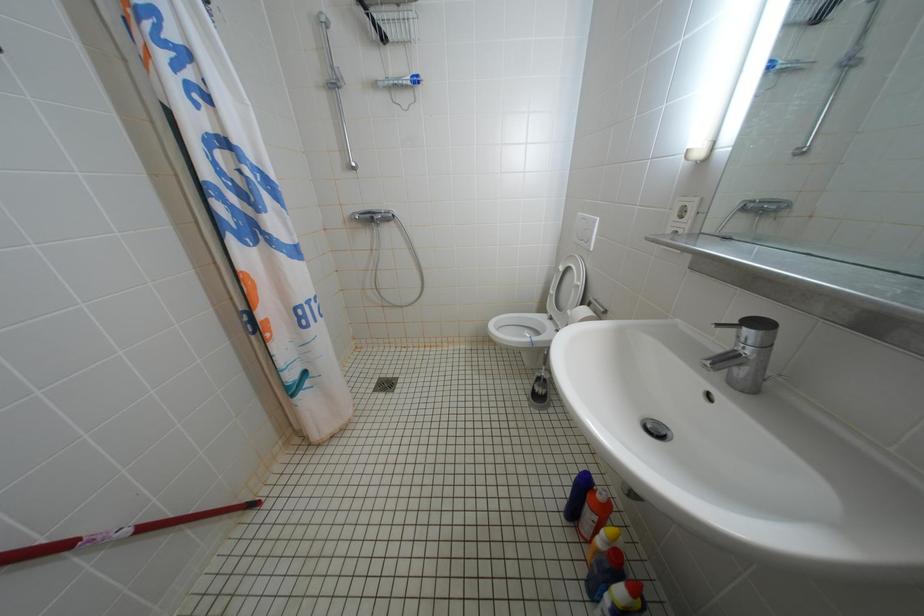
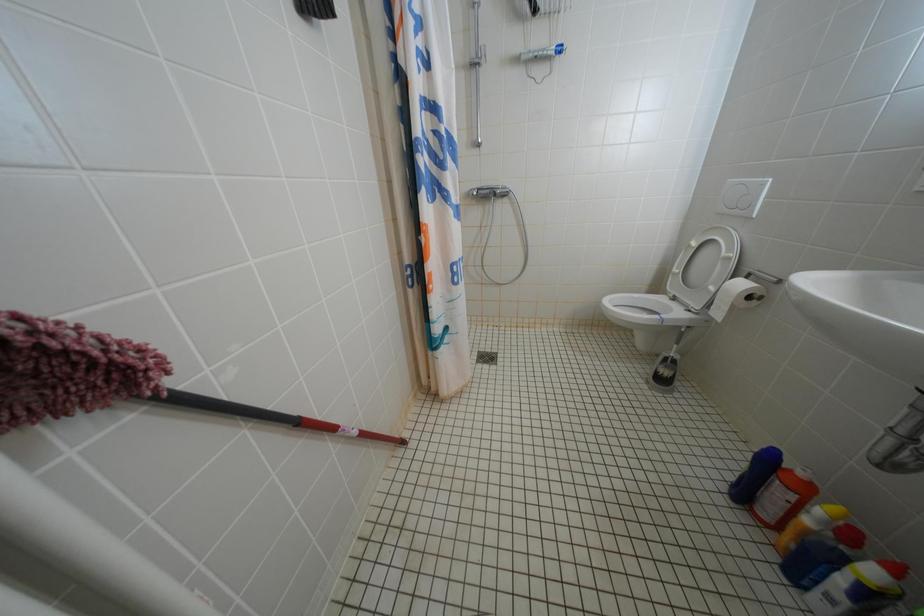
Question: The images are taken continuously from a first-person perspective. In which direction is your viewpoint rotating?

Choices:
 (A) Left
 (B) Right
 (C) Up
 (D) Down

Answer: (A)